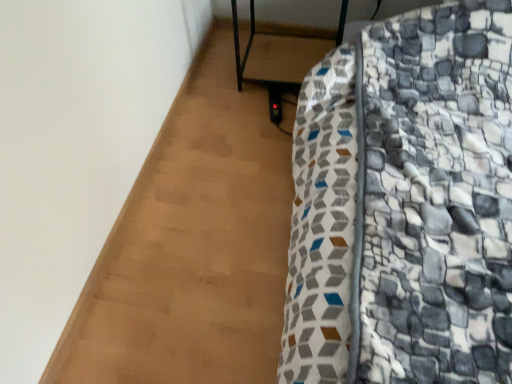
Describe the element at coordinates (246, 47) in the screenshot. I see `metallic black side table at center, the 1th furniture from the top` at that location.

Measure the distance between metallic black side table at center, the 1th furniture from the top, and camera.

metallic black side table at center, the 1th furniture from the top, is 1.83 meters away from camera.

What is the approximate height of metallic black side table at center, the second furniture positioned from the bottom?

18.85 inches.

Identify the location of metallic black side table at center, the 1th furniture from the top. This screenshot has width=512, height=384. [x=246, y=47].

Image resolution: width=512 pixels, height=384 pixels. Describe the element at coordinates (405, 205) in the screenshot. I see `patterned fabric bed at lower right, the 2th furniture when ordered from top to bottom` at that location.

Find the location of `patterned fabric bed at lower right, arranged as the 1th furniture when ordered from the bottom`. patterned fabric bed at lower right, arranged as the 1th furniture when ordered from the bottom is located at coordinates (405, 205).

How much space does patterned fabric bed at lower right, arranged as the 1th furniture when ordered from the bottom, occupy horizontally?

It is 5.57 feet.

Image resolution: width=512 pixels, height=384 pixels. I want to click on metallic black side table at center, the second furniture positioned from the bottom, so click(246, 47).

Based on their positions, is patterned fabric bed at lower right, the 2th furniture when ordered from top to bottom, located to the left or right of metallic black side table at center, the 1th furniture from the top?

patterned fabric bed at lower right, the 2th furniture when ordered from top to bottom, is positioned on metallic black side table at center, the 1th furniture from the top,'s right side.

From the picture: Is patterned fabric bed at lower right, arranged as the 1th furniture when ordered from the bottom, positioned behind metallic black side table at center, the second furniture positioned from the bottom?

No.

Which point is more distant from viewer, (362, 214) or (246, 50)?

The point (246, 50) is behind.

From the image's perspective, which is above, patterned fabric bed at lower right, the 2th furniture when ordered from top to bottom, or metallic black side table at center, the 1th furniture from the top?

From the image's view, metallic black side table at center, the 1th furniture from the top, is above.

From a real-world perspective, is patterned fabric bed at lower right, the 2th furniture when ordered from top to bottom, positioned over metallic black side table at center, the second furniture positioned from the bottom, based on gravity?

Correct, in the physical world, patterned fabric bed at lower right, the 2th furniture when ordered from top to bottom, is higher than metallic black side table at center, the second furniture positioned from the bottom.

Looking at their sizes, would you say patterned fabric bed at lower right, arranged as the 1th furniture when ordered from the bottom, is wider or thinner than metallic black side table at center, the 1th furniture from the top?

Considering their sizes, patterned fabric bed at lower right, arranged as the 1th furniture when ordered from the bottom, looks broader than metallic black side table at center, the 1th furniture from the top.

Which of these two, patterned fabric bed at lower right, arranged as the 1th furniture when ordered from the bottom, or metallic black side table at center, the second furniture positioned from the bottom, stands shorter?

metallic black side table at center, the second furniture positioned from the bottom, is shorter.

Does patterned fabric bed at lower right, arranged as the 1th furniture when ordered from the bottom, have a larger size compared to metallic black side table at center, the second furniture positioned from the bottom?

Yes.

Is patterned fabric bed at lower right, the 2th furniture when ordered from top to bottom, inside the boundaries of metallic black side table at center, the second furniture positioned from the bottom, or outside?

patterned fabric bed at lower right, the 2th furniture when ordered from top to bottom, cannot be found inside metallic black side table at center, the second furniture positioned from the bottom.

Consider the image. Is patterned fabric bed at lower right, arranged as the 1th furniture when ordered from the bottom, in contact with metallic black side table at center, the second furniture positioned from the bottom?

No, patterned fabric bed at lower right, arranged as the 1th furniture when ordered from the bottom, is not touching metallic black side table at center, the second furniture positioned from the bottom.

Is patterned fabric bed at lower right, the 2th furniture when ordered from top to bottom, positioned with its back to metallic black side table at center, the 1th furniture from the top?

patterned fabric bed at lower right, the 2th furniture when ordered from top to bottom, is not turned away from metallic black side table at center, the 1th furniture from the top.

How many degrees apart are the facing directions of patterned fabric bed at lower right, the 2th furniture when ordered from top to bottom, and metallic black side table at center, the 1th furniture from the top?

1.7 degrees.

Could you measure the distance between patterned fabric bed at lower right, arranged as the 1th furniture when ordered from the bottom, and metallic black side table at center, the second furniture positioned from the bottom?

The distance of patterned fabric bed at lower right, arranged as the 1th furniture when ordered from the bottom, from metallic black side table at center, the second furniture positioned from the bottom, is 30.26 inches.

You are a GUI agent. You are given a task and a screenshot of the screen. Output one action in this format:
    pyautogui.click(x=<x>, y=<y>)
    Task: Click on the furniture that is above the metallic black side table at center, the 1th furniture from the top (from a real-world perspective)
    
    Given the screenshot: What is the action you would take?
    pyautogui.click(x=405, y=205)

Based on their positions, is metallic black side table at center, the second furniture positioned from the bottom, located to the left or right of patterned fabric bed at lower right, the 2th furniture when ordered from top to bottom?

metallic black side table at center, the second furniture positioned from the bottom, is to the left of patterned fabric bed at lower right, the 2th furniture when ordered from top to bottom.

Looking at this image, does metallic black side table at center, the 1th furniture from the top, lie in front of patterned fabric bed at lower right, arranged as the 1th furniture when ordered from the bottom?

No, metallic black side table at center, the 1th furniture from the top, is further to the viewer.

Considering the points (249, 40) and (387, 129), which point is in front, point (249, 40) or point (387, 129)?

The point (387, 129) is more forward.

From the image's perspective, is metallic black side table at center, the second furniture positioned from the bottom, located beneath patterned fabric bed at lower right, arranged as the 1th furniture when ordered from the bottom?

No, from the image's perspective, metallic black side table at center, the second furniture positioned from the bottom, is not below patterned fabric bed at lower right, arranged as the 1th furniture when ordered from the bottom.

From a real-world perspective, is metallic black side table at center, the 1th furniture from the top, physically located above or below patterned fabric bed at lower right, the 2th furniture when ordered from top to bottom?

Clearly, from a real-world perspective, metallic black side table at center, the 1th furniture from the top, is below patterned fabric bed at lower right, the 2th furniture when ordered from top to bottom.

Which object is thinner, metallic black side table at center, the 1th furniture from the top, or patterned fabric bed at lower right, the 2th furniture when ordered from top to bottom?

metallic black side table at center, the 1th furniture from the top, is thinner.

Considering the relative sizes of metallic black side table at center, the second furniture positioned from the bottom, and patterned fabric bed at lower right, the 2th furniture when ordered from top to bottom, in the image provided, is metallic black side table at center, the second furniture positioned from the bottom, shorter than patterned fabric bed at lower right, the 2th furniture when ordered from top to bottom,?

Yes.

Considering the relative sizes of metallic black side table at center, the 1th furniture from the top, and patterned fabric bed at lower right, the 2th furniture when ordered from top to bottom, in the image provided, is metallic black side table at center, the 1th furniture from the top, smaller than patterned fabric bed at lower right, the 2th furniture when ordered from top to bottom,?

Yes, metallic black side table at center, the 1th furniture from the top, is smaller than patterned fabric bed at lower right, the 2th furniture when ordered from top to bottom.

Do you think metallic black side table at center, the 1th furniture from the top, is within patterned fabric bed at lower right, arranged as the 1th furniture when ordered from the bottom, or outside of it?

metallic black side table at center, the 1th furniture from the top, is inside patterned fabric bed at lower right, arranged as the 1th furniture when ordered from the bottom.

Is metallic black side table at center, the 1th furniture from the top, directly adjacent to patterned fabric bed at lower right, arranged as the 1th furniture when ordered from the bottom?

No, metallic black side table at center, the 1th furniture from the top, is not touching patterned fabric bed at lower right, arranged as the 1th furniture when ordered from the bottom.

Is metallic black side table at center, the second furniture positioned from the bottom, looking in the opposite direction of patterned fabric bed at lower right, the 2th furniture when ordered from top to bottom?

No.

How different are the orientations of metallic black side table at center, the 1th furniture from the top, and patterned fabric bed at lower right, the 2th furniture when ordered from top to bottom, in degrees?

1.7 degrees separate the facing orientations of metallic black side table at center, the 1th furniture from the top, and patterned fabric bed at lower right, the 2th furniture when ordered from top to bottom.

Measure the distance from metallic black side table at center, the 1th furniture from the top, to patterned fabric bed at lower right, the 2th furniture when ordered from top to bottom.

They are 30.26 inches apart.

Identify the location of furniture that is below the metallic black side table at center, the 1th furniture from the top (from the image's perspective). click(405, 205).

Find the location of a particular element. furniture on the right of metallic black side table at center, the second furniture positioned from the bottom is located at coordinates (405, 205).

The image size is (512, 384). I want to click on furniture above the metallic black side table at center, the second furniture positioned from the bottom (from a real-world perspective), so click(405, 205).